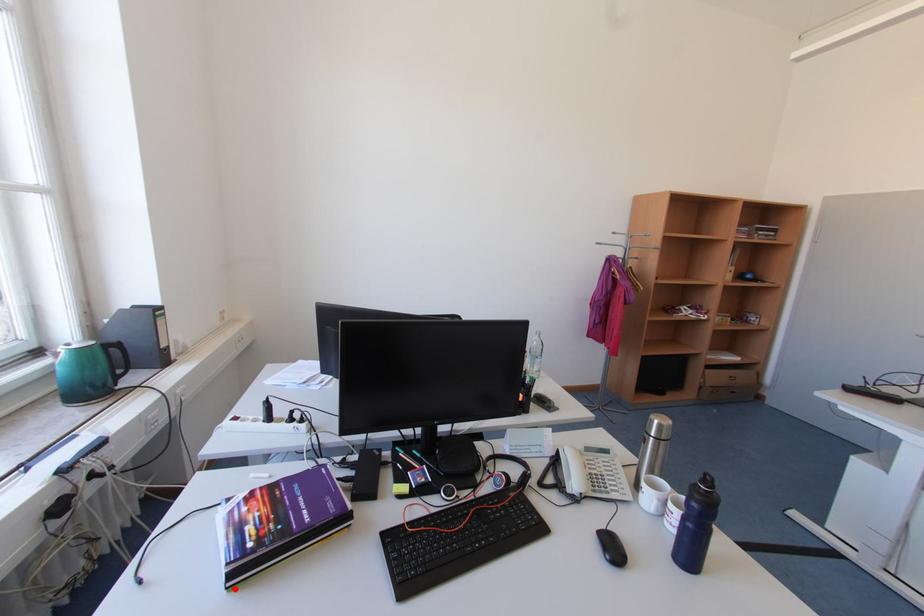
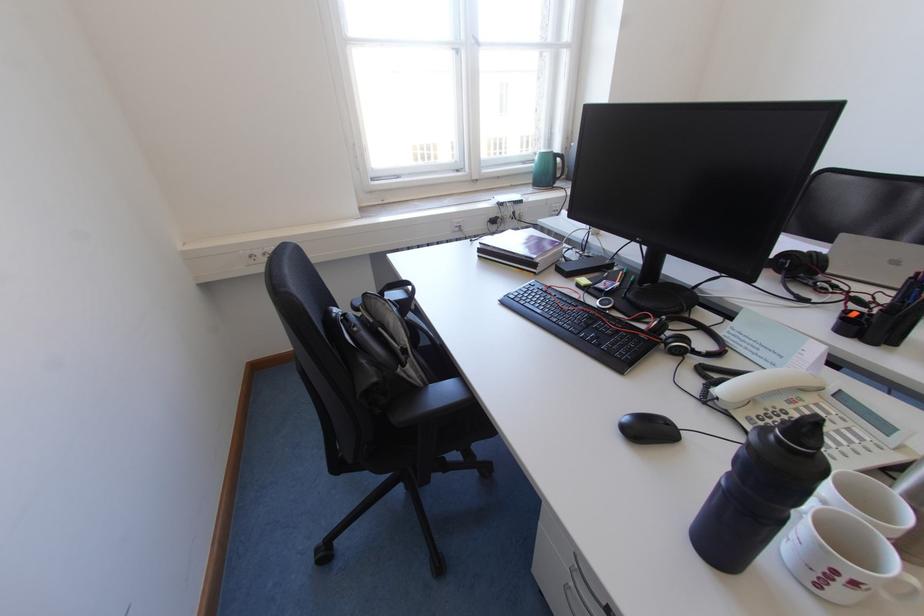
The point at the highlighted location is marked in the first image. Where is the corresponding point in the second image?

(487, 257)